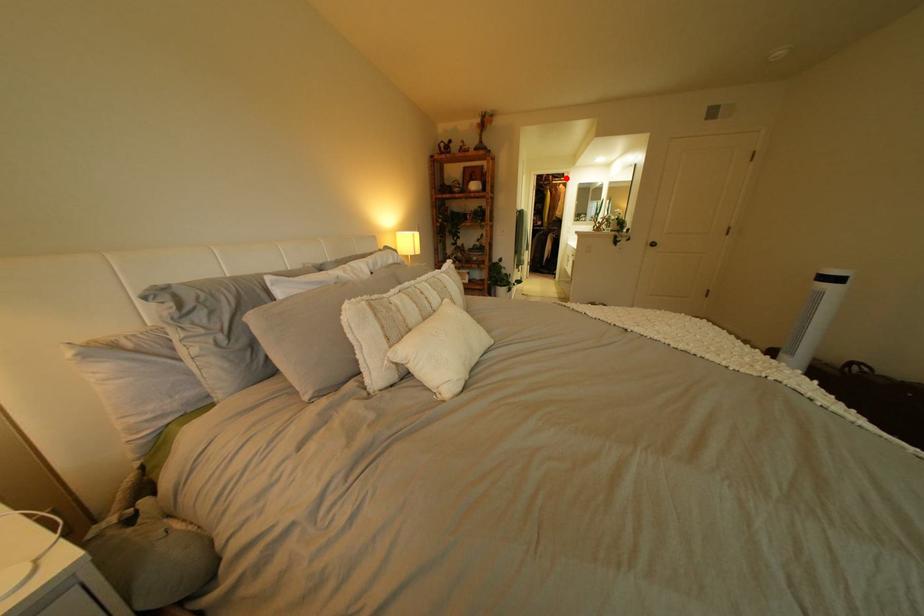
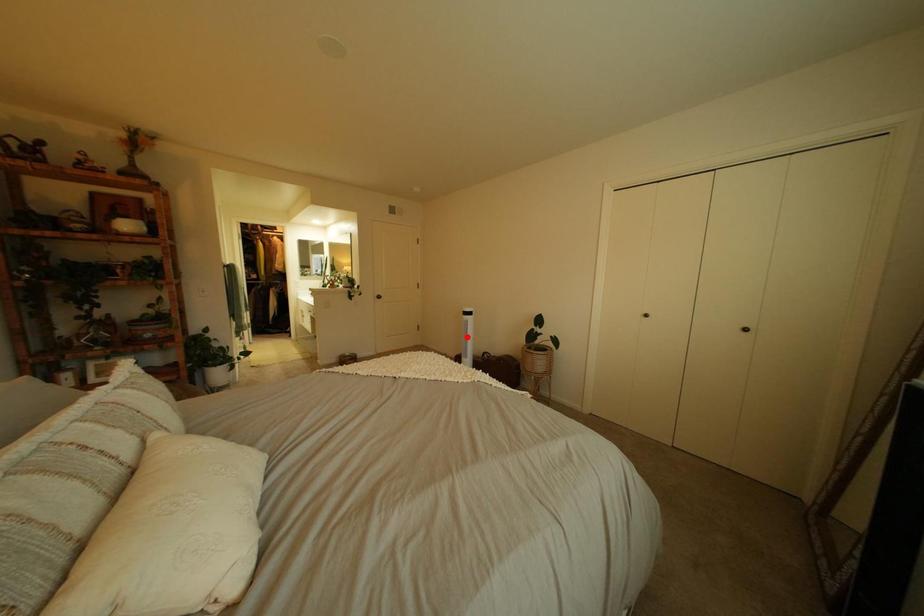
I am providing you with two images of the same scene from different viewpoints. A red point is marked on the first image and another point is marked on the second image. Do the highlighted points in image1 and image2 indicate the same real-world spot?

No